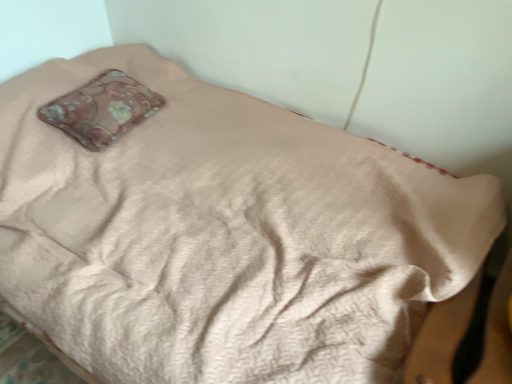
What do you see at coordinates (102, 109) in the screenshot? The height and width of the screenshot is (384, 512). I see `floral-patterned fabric pillow at upper left` at bounding box center [102, 109].

The image size is (512, 384). Find the location of `floral-patterned fabric pillow at upper left`. floral-patterned fabric pillow at upper left is located at coordinates (102, 109).

In order to face floral-patterned fabric pillow at upper left, should I rotate leftwards or rightwards?

To align with it, rotate left about 19.512°.

The image size is (512, 384). Identify the location of floral-patterned fabric pillow at upper left. (102, 109).